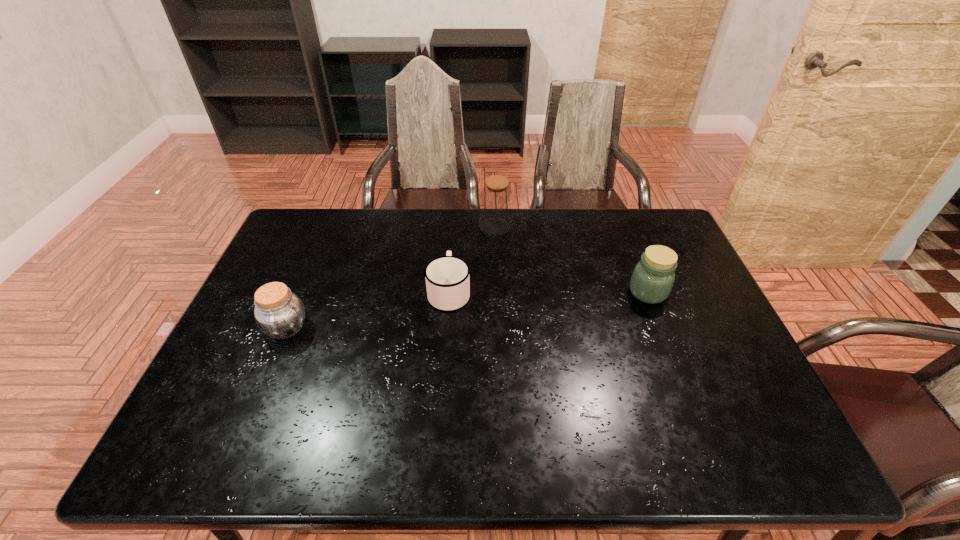
You are a GUI agent. You are given a task and a screenshot of the screen. Output one action in this format:
    pyautogui.click(x=<x>, y=<y>)
    Task: Click on the vacant space at the right edge of the desktop
    
    Given the screenshot: What is the action you would take?
    711,364

The height and width of the screenshot is (540, 960). Find the location of `vacant region at the near left corner of the desktop`. vacant region at the near left corner of the desktop is located at coordinates (170, 447).

Identify the location of vacant area at the far right corner of the desktop. (661, 244).

The width and height of the screenshot is (960, 540). What are the coordinates of `free space at the near right corner of the desktop` in the screenshot? It's located at (766, 430).

Where is `free space between the second object from left to right and the farthest object`? free space between the second object from left to right and the farthest object is located at coordinates (472, 259).

You are a GUI agent. You are given a task and a screenshot of the screen. Output one action in this format:
    pyautogui.click(x=<x>, y=<y>)
    Task: Click on the free spot between the mug and the rightmost object
    The image size is (960, 540).
    Given the screenshot: What is the action you would take?
    pyautogui.click(x=548, y=292)

Where is `vacant region between the shortest object and the farthest object`? This screenshot has width=960, height=540. vacant region between the shortest object and the farthest object is located at coordinates (472, 259).

What are the coordinates of `free space between the shortest object and the leftmost jar` in the screenshot? It's located at (368, 310).

Identify the location of unoccupied position between the third object from left to right and the leftmost jar. (391, 277).

This screenshot has width=960, height=540. What are the coordinates of `free space between the second object from left to right and the nearest jar` in the screenshot? It's located at (368, 310).